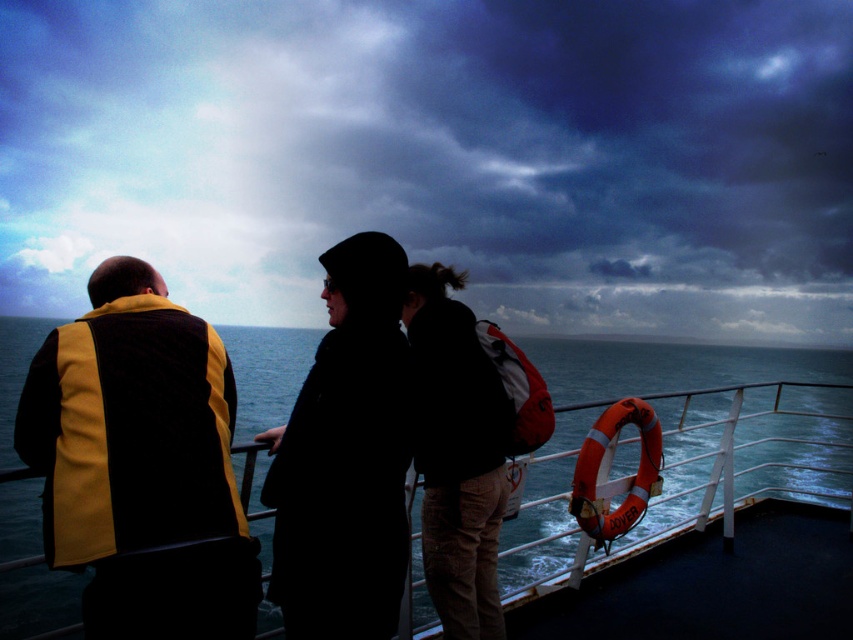
From the picture: Does yellow and black fabric life vest at left have a smaller size compared to orange rubber life ring at right?

Incorrect, yellow and black fabric life vest at left is not smaller in size than orange rubber life ring at right.

The height and width of the screenshot is (640, 853). Describe the element at coordinates (140, 461) in the screenshot. I see `yellow and black fabric life vest at left` at that location.

Find the location of a particular element. This screenshot has width=853, height=640. yellow and black fabric life vest at left is located at coordinates (140, 461).

I want to click on yellow and black fabric life vest at left, so click(140, 461).

Describe the element at coordinates (140, 461) in the screenshot. I see `yellow and black fabric life vest at left` at that location.

Does yellow and black fabric life vest at left have a lesser height compared to dark brown leather jacket at center?

Yes.

Find the location of `yellow and black fabric life vest at left`. yellow and black fabric life vest at left is located at coordinates (140, 461).

Is dark fabric coat at center positioned in front of red fabric backpack at center?

Yes, it is in front of red fabric backpack at center.

Who is higher up, dark fabric coat at center or red fabric backpack at center?

Positioned higher is red fabric backpack at center.

Which is behind, point (393, 413) or point (537, 435)?

Point (537, 435)

Find the location of a particular element. dark fabric coat at center is located at coordinates (346, 456).